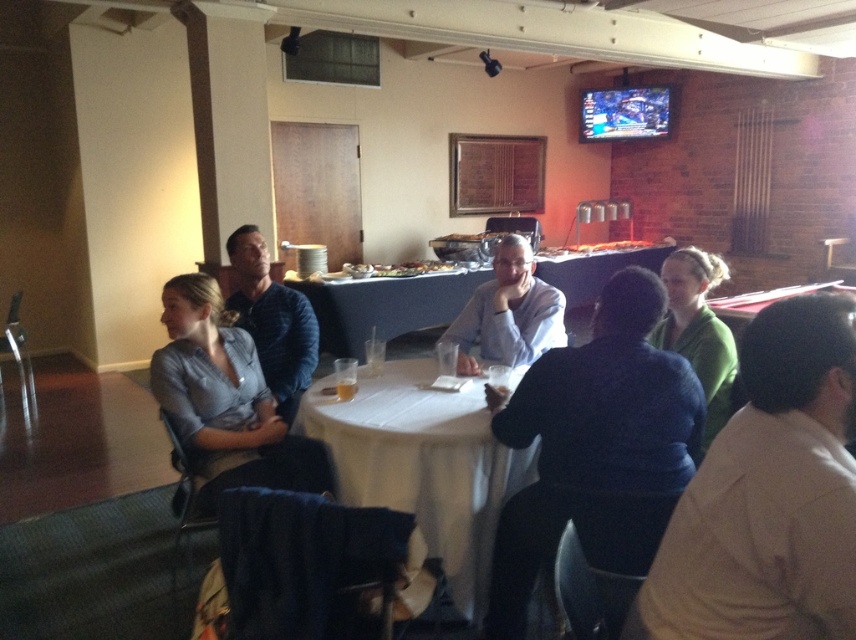
You are attending a meeting and notice two people sitting at the table wearing the blue sweater at center and the matte gray shirt at center. Which person is sitting closer to the table?

The blue sweater at center is positioned under matte gray shirt at center, so the person wearing the blue sweater at center is sitting closer to the table.

You are organizing a clothing display and need to arrange the blue striped polo shirt at center and the green matte sweater at upper right on a rack. Based on their sizes, which one should be placed on the left side of the rack to ensure proper visibility?

The blue striped polo shirt at center has a smaller width than the green matte sweater at upper right, so placing it on the left side of the rack will allow both items to be visible without overcrowding.